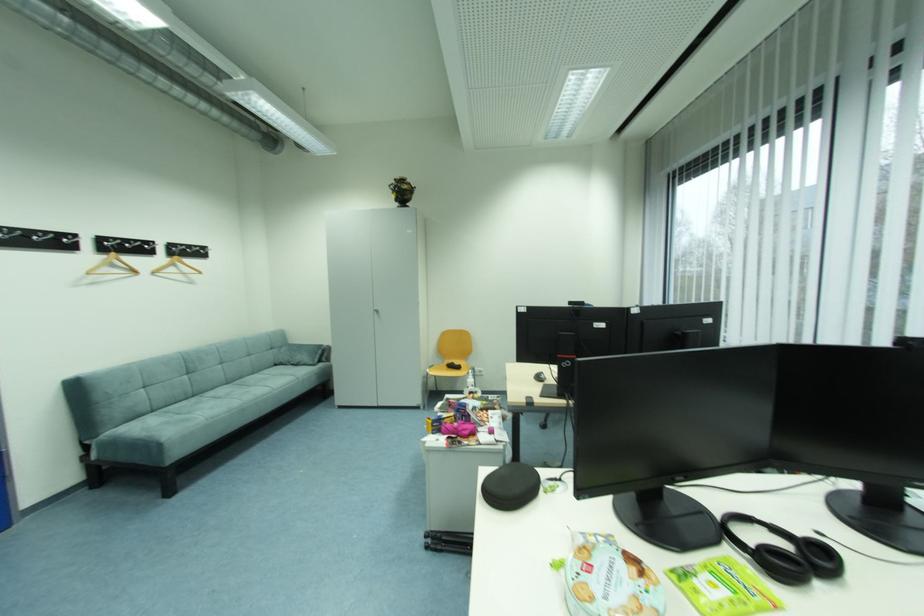
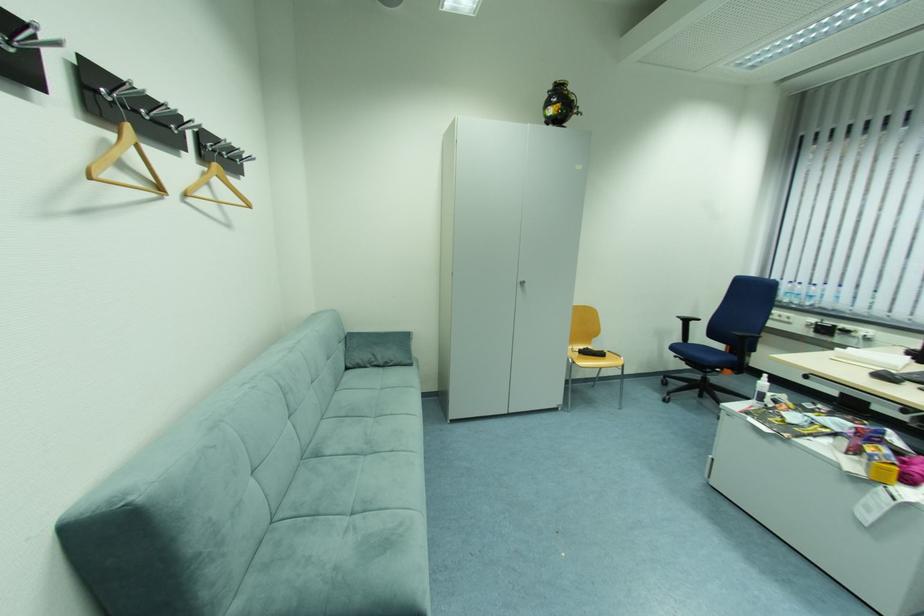
Find the pixel in the second image that matches pixel 186 265 in the first image.

(223, 182)